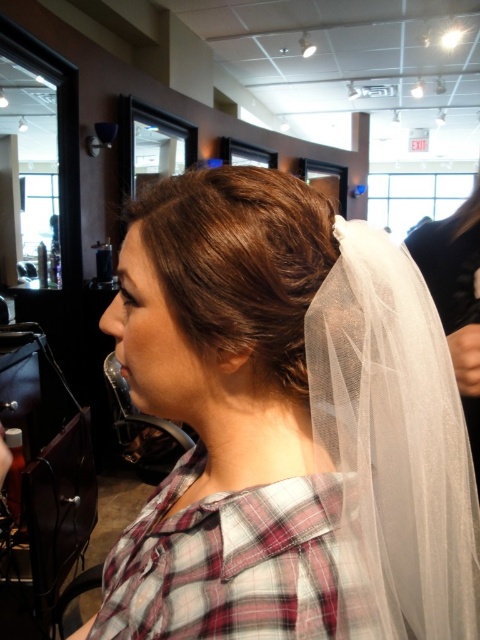
You are a photographer setting up for a portrait. You notice the white sheer veil at upper center and the brown silky hair bun at upper center. From the subject position, which object is positioned to the left?

The white sheer veil at upper center is to the left of the brown silky hair bun at upper center.

In the scene shown: You are a makeup artist working on a client whose head is positioned so that both the white sheer veil at upper center and the brown silky hair bun at upper center are visible. You need to apply eyeliner precisely between them. Given that your eyeliner brush is 3 inches long, can you reach the space between them without moving either object?

The distance between the white sheer veil at upper center and the brown silky hair bun at upper center is 3.40 inches. Since your eyeliner brush is 3 inches long, it is shorter than the gap between them. Therefore, you cannot reach the space between them without moving either object.

You are a customer in the salon and want to touch the point at coordinates [288,426]. Which object should you reach for?

The point at coordinates [288,426] is on the white sheer veil at upper center, so you should reach for the white sheer veil at upper center.